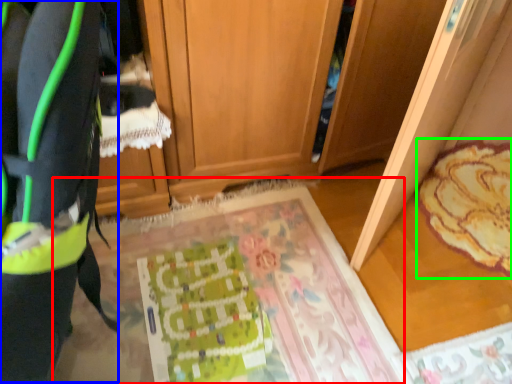
Question: Which object is positioned closest to mat (highlighted by a red box)? Select from wide (highlighted by a blue box) and mat (highlighted by a green box).

Choices:
 (A) wide
 (B) mat

Answer: (B)